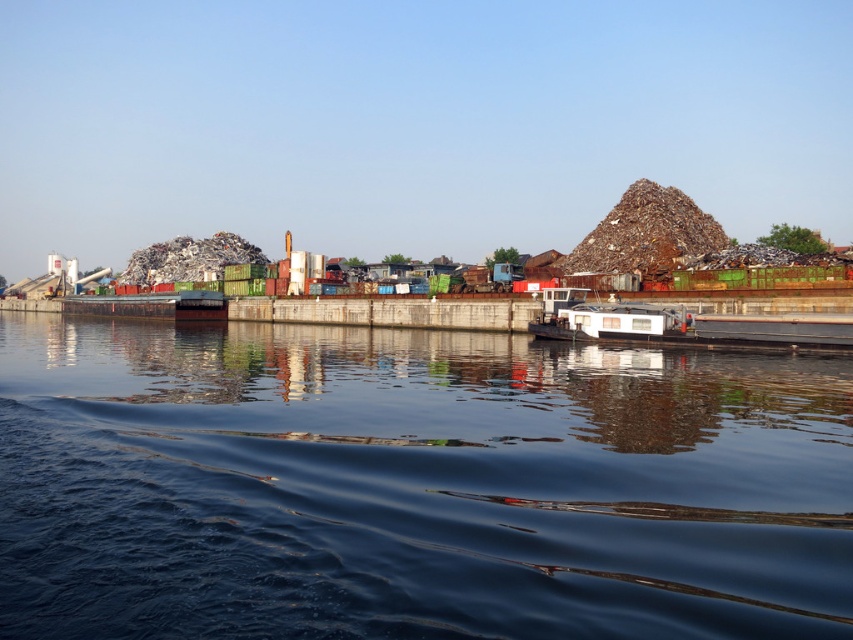
This screenshot has height=640, width=853. Describe the element at coordinates (415, 484) in the screenshot. I see `dark blue water at center` at that location.

Does dark blue water at center appear under white matte houseboat at center?

Indeed, dark blue water at center is positioned under white matte houseboat at center.

This screenshot has width=853, height=640. What do you see at coordinates (415, 484) in the screenshot?
I see `dark blue water at center` at bounding box center [415, 484].

Where is `dark blue water at center`? The image size is (853, 640). dark blue water at center is located at coordinates (415, 484).